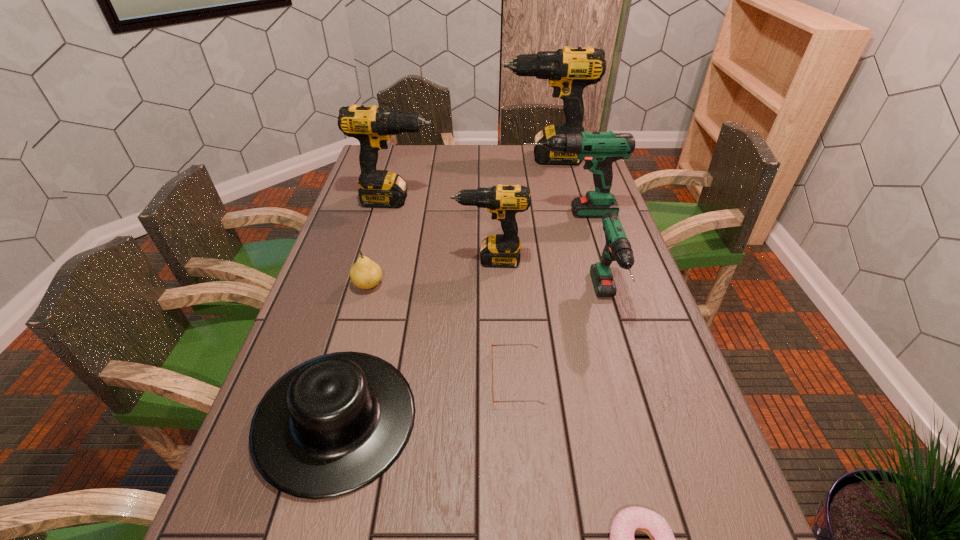
The image size is (960, 540). In order to click on pear in this screenshot , I will do `click(365, 274)`.

Locate an element on the screen. sunglasses is located at coordinates (495, 344).

I want to click on free space located 0.300m at the tip of the tallest object, so click(427, 158).

I want to click on vacant region located 0.120m at the tip of the tallest object, so click(x=471, y=158).

You are a GUI agent. You are given a task and a screenshot of the screen. Output one action in this format:
    pyautogui.click(x=<x>, y=<y>)
    Task: Click on the free region located at the tip of the tallest object
    The width and height of the screenshot is (960, 540).
    Given the screenshot: What is the action you would take?
    [478, 158]

Identify the location of free region located at the tip of the leftmost drill. The height and width of the screenshot is (540, 960). (530, 200).

At what (x,y) coordinates should I click in order to perform the action: click on free space located on the handle side of the bigger green drill. Please return your answer as a coordinate pair (x, y). This screenshot has width=960, height=540. Looking at the image, I should click on (501, 213).

Locate an element on the screen. This screenshot has width=960, height=540. free space located 0.340m on the handle side of the bigger green drill is located at coordinates (420, 213).

This screenshot has height=540, width=960. What are the coordinates of `free region located 0.120m on the handle side of the bigger green drill` in the screenshot? It's located at (484, 213).

Locate an element on the screen. This screenshot has height=540, width=960. free region located at the tip of the fourth farthest drill is located at coordinates (343, 260).